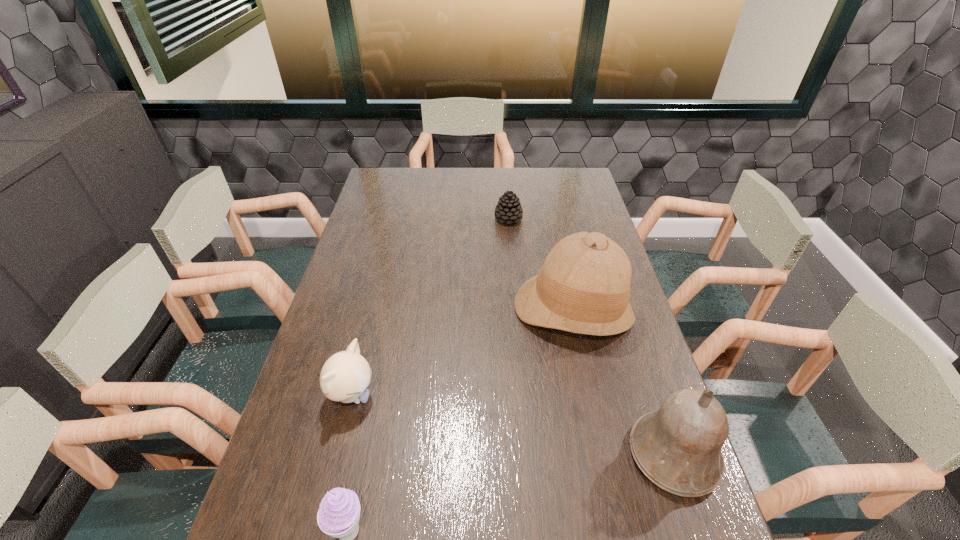
This screenshot has height=540, width=960. Identify the location of vacant spot on the desktop that is between the icecream and the fourth shortest object and is positioned at the narrow end of the farthest object. (542, 485).

Identify the location of free spot on the desktop that is between the icecream and the second tallest object and is positioned on the face of the kitten. (557, 482).

The height and width of the screenshot is (540, 960). In order to click on free space on the desktop that is between the icecream and the bell and is positioned on the front-facing side of the tallest object in this screenshot , I will do (549, 484).